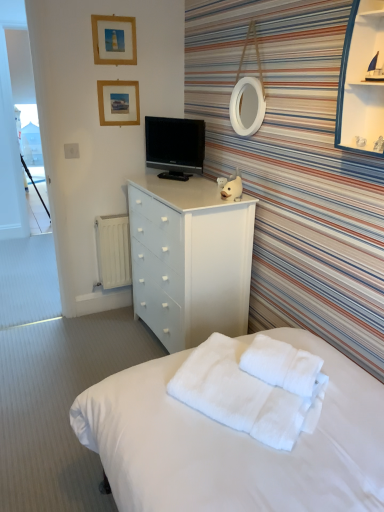
Locate an element on the screen. The image size is (384, 512). vacant space that is to the left of white soft towel at lower center is located at coordinates point(231,380).